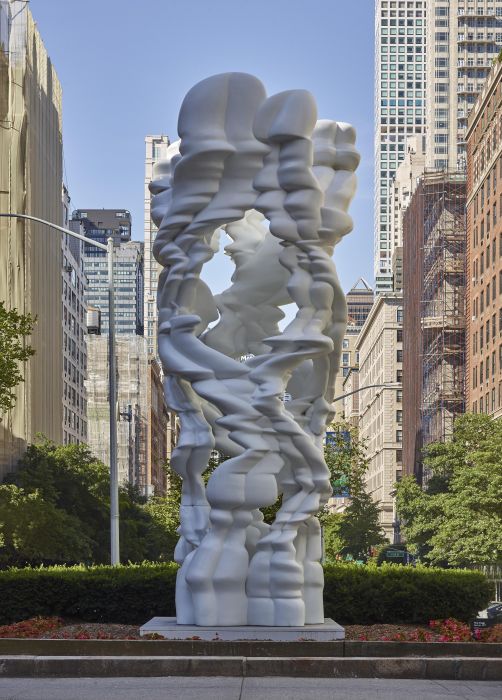
Locate an element on the screen. The width and height of the screenshot is (502, 700). statue is located at coordinates (234, 202).